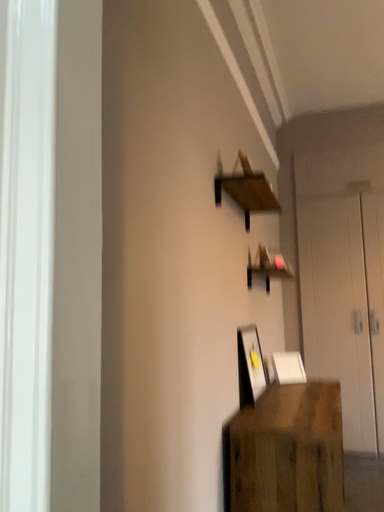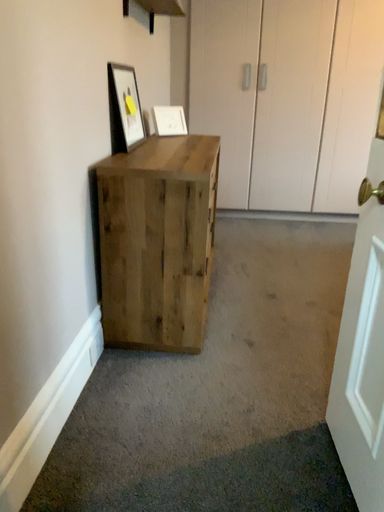
Question: How did the camera likely rotate when shooting the video?

Choices:
 (A) rotated downward
 (B) rotated upward

Answer: (A)